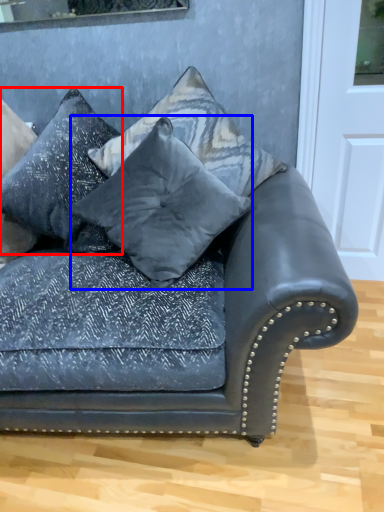
Question: Among these objects, which one is nearest to the camera, pillow (highlighted by a red box) or pillow (highlighted by a blue box)?

Choices:
 (A) pillow
 (B) pillow

Answer: (B)